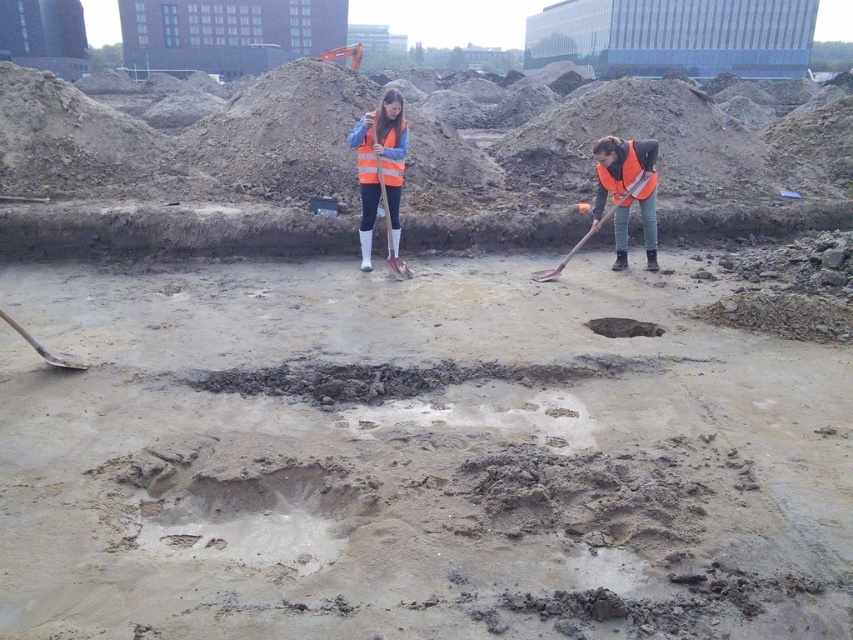
You are a safety inspector at the construction site. You need to ensure that the reflective orange safety vest at center is within a 2 meter safety radius of the metallic shovel at right to comply with safety regulations. Is this requirement met?

The distance between the reflective orange safety vest at center and the metallic shovel at right is 2.15 meters, which exceeds the 2 meter safety radius requirement. Therefore, the requirement is not met.

You are standing at the excavation site and need to hand the orange plastic shovel at center to a colleague who is 30 feet away from you. Can you reach them without moving from your current position?

The orange plastic shovel at center is 25.86 feet away from you, so you can reach your colleague who is 30 feet away by extending your arm, as the shovel is closer than the distance to your colleague.